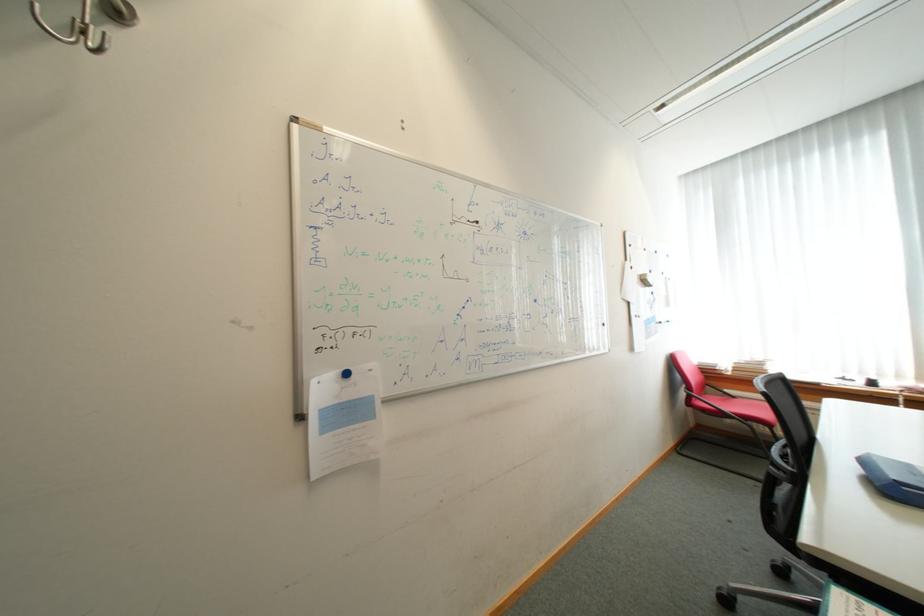
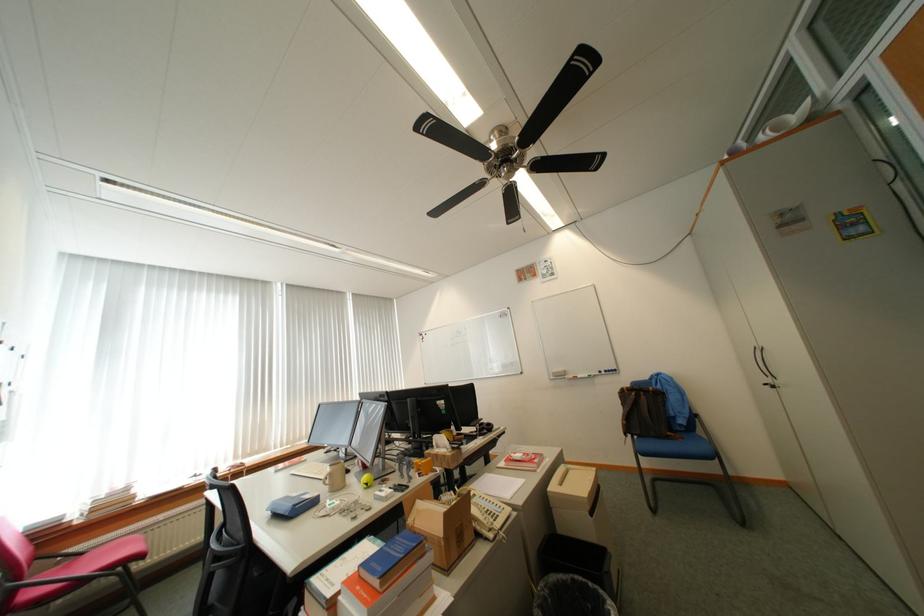
The first image is from the beginning of the video and the second image is from the end. How did the camera likely rotate when shooting the video?

The camera rotated toward right-up.